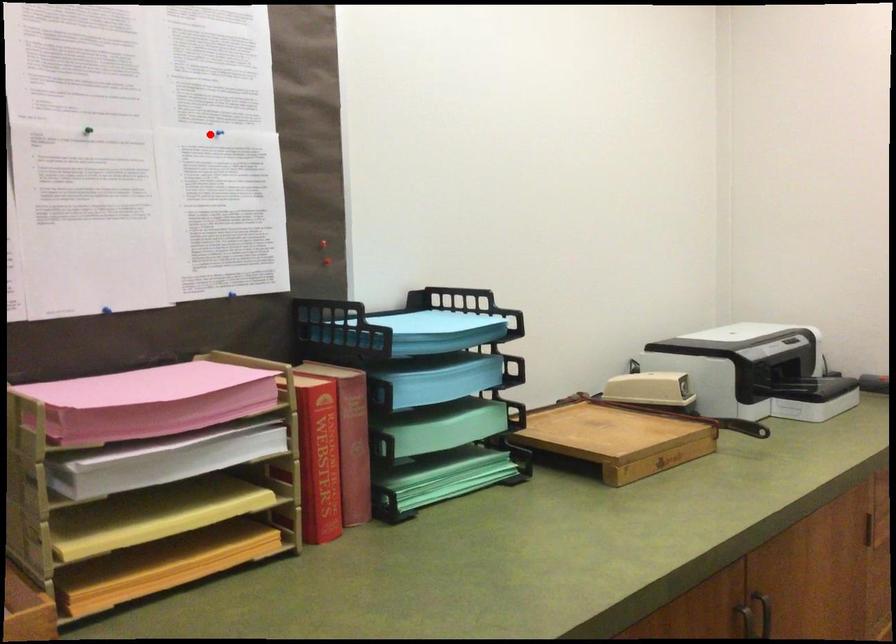
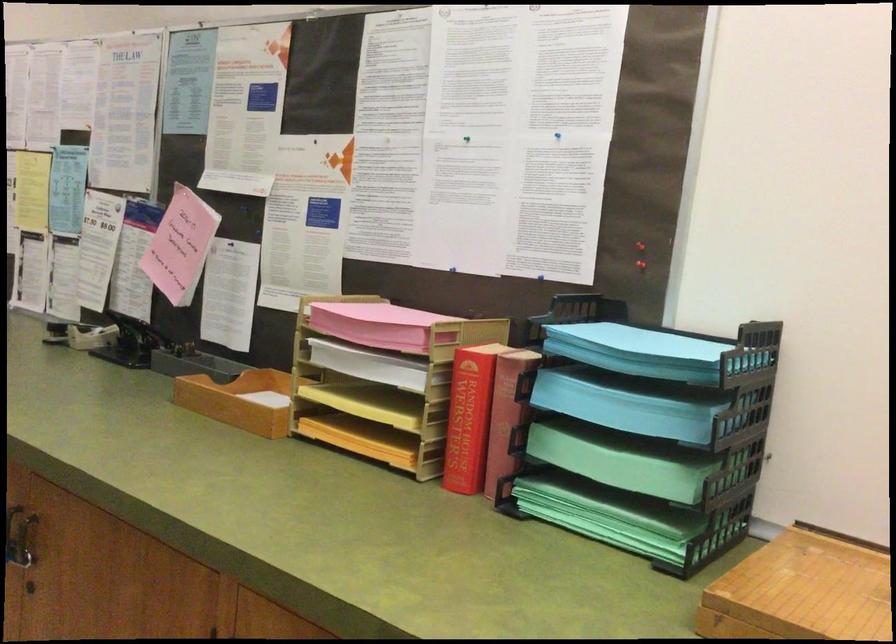
Question: I am providing you with two images of the same scene from different viewpoints. Image1 has a red point marked. In image2, the corresponding 3D location appears at what relative position? Reply with the corresponding letter.

Choices:
 (A) Closer
 (B) Farther

Answer: (B)